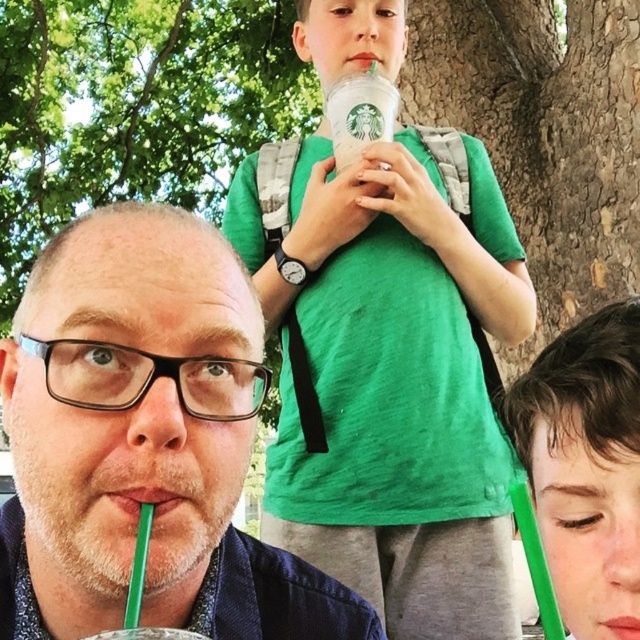
You are a photographer trying to capture a photo of both the green matte shirt at center and the matte green straw at upper right. Since you want both subjects in the frame, can you tell me which direction you should move the camera to the left or to the right?

The green matte shirt at center is to the left of the matte green straw at upper right. To include both in the frame, you should move the camera to the left so that the green matte shirt at center stays visible while also capturing the matte green straw at upper right on the right side of the frame.

You are standing in the outdoor scene and want to walk from point A to point B. Point A is at coordinate point(337,147) and point B is at coordinate point(141,628). Which point is closer to you when you start walking?

Point A at coordinate point(337,147) is closer to you because it is further to the viewer than point B at coordinate point(141,628).